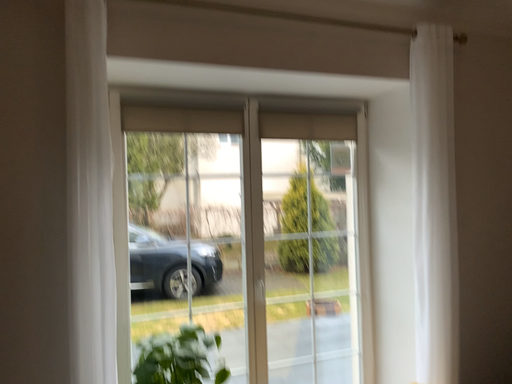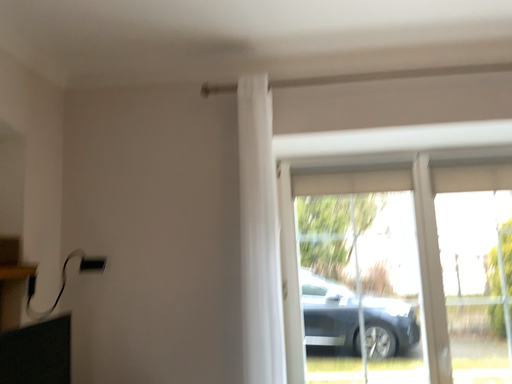
Question: How did the camera likely rotate when shooting the video?

Choices:
 (A) rotated downward
 (B) rotated upward

Answer: (B)